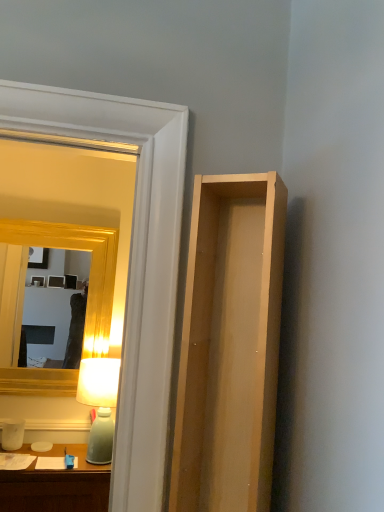
Question: From the image's perspective, is light wood cabinet at right above or below matte green glass table lamp at left?

Choices:
 (A) above
 (B) below

Answer: (A)

Question: In the image, is light wood cabinet at right positioned in front of or behind matte green glass table lamp at left?

Choices:
 (A) front
 (B) behind

Answer: (A)

Question: Which of these objects is positioned farthest from the clear glass door at upper left?

Choices:
 (A) gold wooden mirror at upper left
 (B) light wood cabinet at right
 (C) matte green glass table lamp at left

Answer: (A)

Question: Considering the real-world distances, which object is farthest from the matte green glass table lamp at left?

Choices:
 (A) clear glass door at upper left
 (B) gold wooden mirror at upper left
 (C) light wood cabinet at right

Answer: (C)